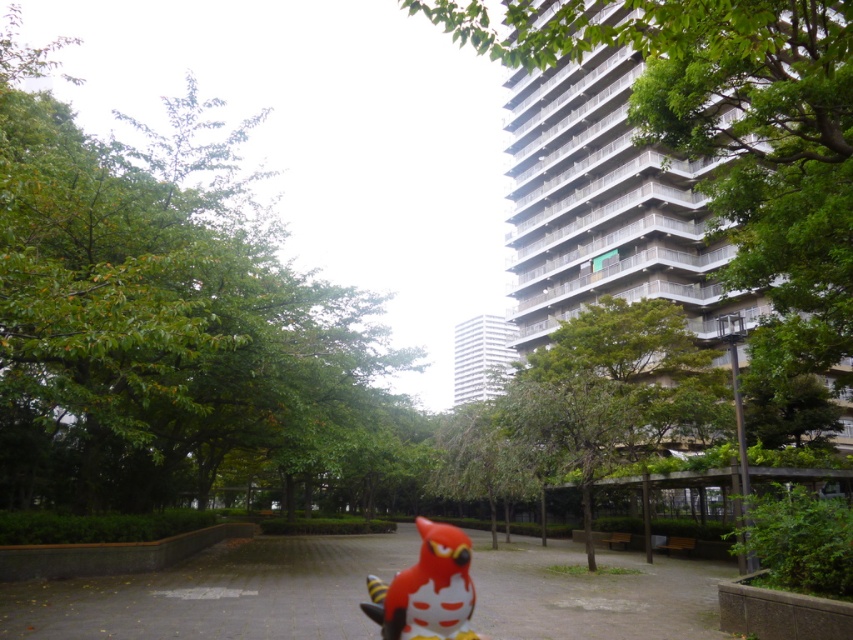
Between green leafy tree at upper left and matte red bird at center, which one is positioned lower?

matte red bird at center

Does point (183, 262) lie in front of point (465, 544)?

No, it is not.

The height and width of the screenshot is (640, 853). What are the coordinates of `green leafy tree at upper left` in the screenshot? It's located at (165, 317).

Where is `green leafy tree at upper left`? Image resolution: width=853 pixels, height=640 pixels. green leafy tree at upper left is located at coordinates (165, 317).

Who is positioned more to the left, green leafy tree at upper left or green leafy tree at upper right?

green leafy tree at upper left is more to the left.

Describe the element at coordinates (165, 317) in the screenshot. The image size is (853, 640). I see `green leafy tree at upper left` at that location.

Which is behind, point (140, 182) or point (799, 141)?

The point (140, 182) is behind.

The width and height of the screenshot is (853, 640). In order to click on green leafy tree at upper left in this screenshot , I will do `click(165, 317)`.

Consider the image. Does green leafy tree at upper right lie in front of matte red bird at center?

That is True.

From the picture: Is the position of green leafy tree at upper right more distant than that of matte red bird at center?

No, it is not.

Is point (839, 22) farther from camera compared to point (421, 534)?

No, it is not.

Identify the location of green leafy tree at upper right. This screenshot has height=640, width=853. (724, 120).